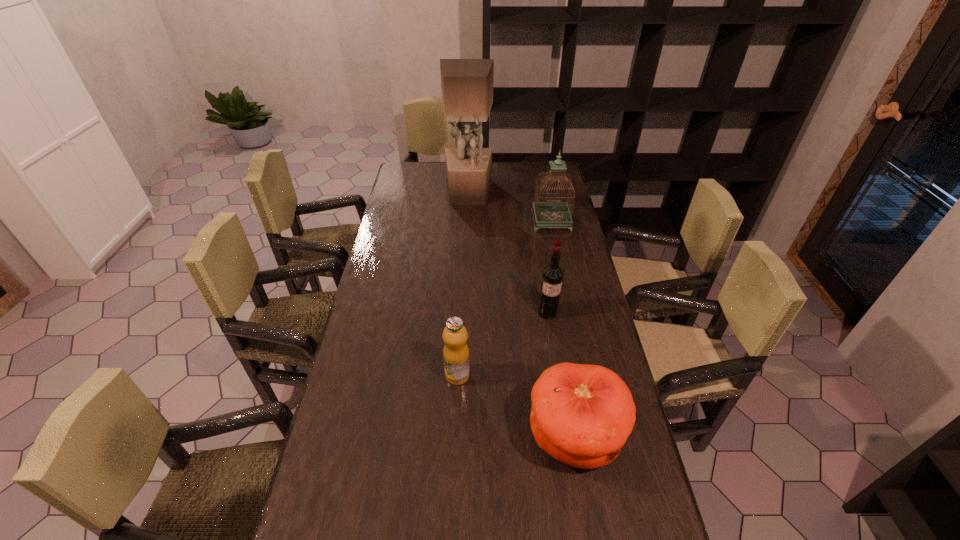
You are a GUI agent. You are given a task and a screenshot of the screen. Output one action in this format:
    pyautogui.click(x=<x>, y=<y>)
    Task: Click on the blank space located 0.280m on the left of the nearest object
    Image resolution: width=960 pixels, height=540 pixels.
    Given the screenshot: What is the action you would take?
    (x=419, y=436)

In order to click on object that is positioned at the far edge in this screenshot , I will do `click(467, 84)`.

Where is `birdcage that is at the right edge`? The width and height of the screenshot is (960, 540). birdcage that is at the right edge is located at coordinates (553, 213).

Locate an element on the screen. wine bottle located in the right edge section of the desktop is located at coordinates (552, 277).

Find the location of `pumpkin located at the right edge`. pumpkin located at the right edge is located at coordinates (581, 415).

Locate an element on the screen. This screenshot has width=960, height=540. blank space at the far edge is located at coordinates point(445,168).

In the image, there is a desktop. Identify the location of vacant space at the left edge. (386, 402).

This screenshot has height=540, width=960. In order to click on free space at the right edge of the desktop in this screenshot , I will do `click(568, 249)`.

At what (x,y) coordinates should I click in order to perform the action: click on free region at the far left corner of the desktop. Please return your answer as a coordinate pair (x, y). The image size is (960, 540). Looking at the image, I should click on (409, 173).

Where is `free space between the wine bottle and the tallest object`? free space between the wine bottle and the tallest object is located at coordinates (508, 253).